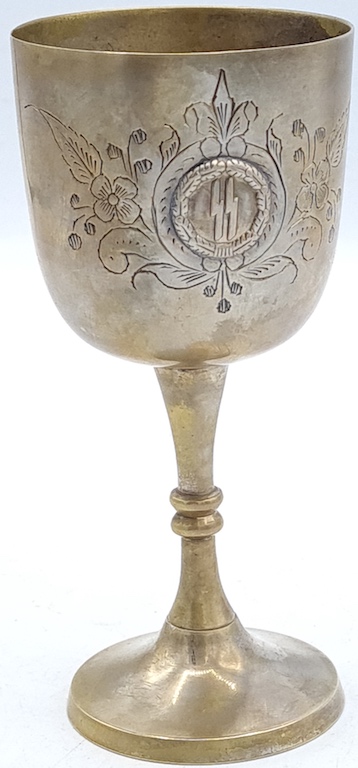
Find the location of a particular element. The width and height of the screenshot is (358, 768). flower design on the front of the goblet bowl is located at coordinates (112, 193).